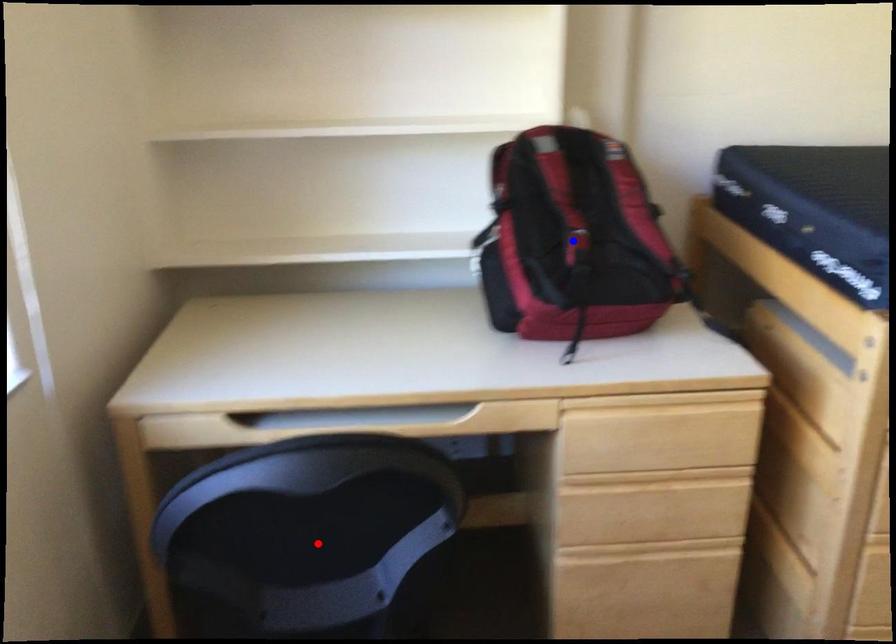
Question: Two points are marked on the image. Which point is closer to the camera?

Choices:
 (A) Blue point is closer.
 (B) Red point is closer.

Answer: (B)